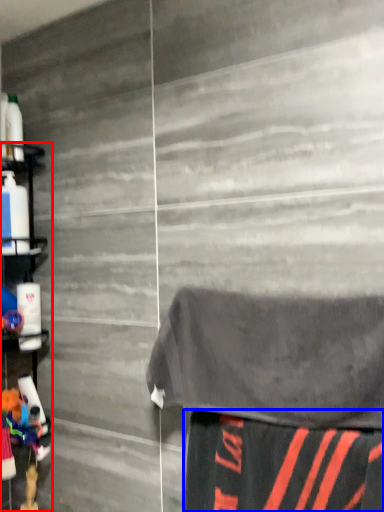
Question: Which point is further to the camera, shelf (highlighted by a red box) or fabric (highlighted by a blue box)?

Choices:
 (A) shelf
 (B) fabric

Answer: (A)